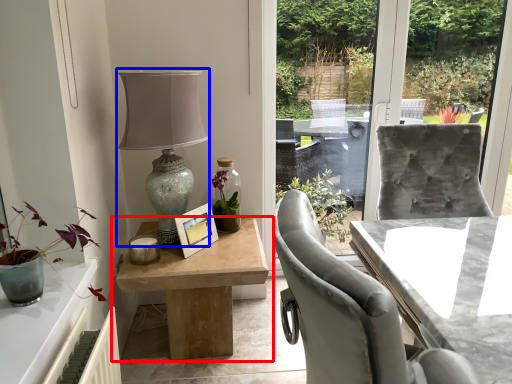
Question: Which point is closer to the camera, table (highlighted by a red box) or table lamp (highlighted by a blue box)?

Choices:
 (A) table
 (B) table lamp

Answer: (B)